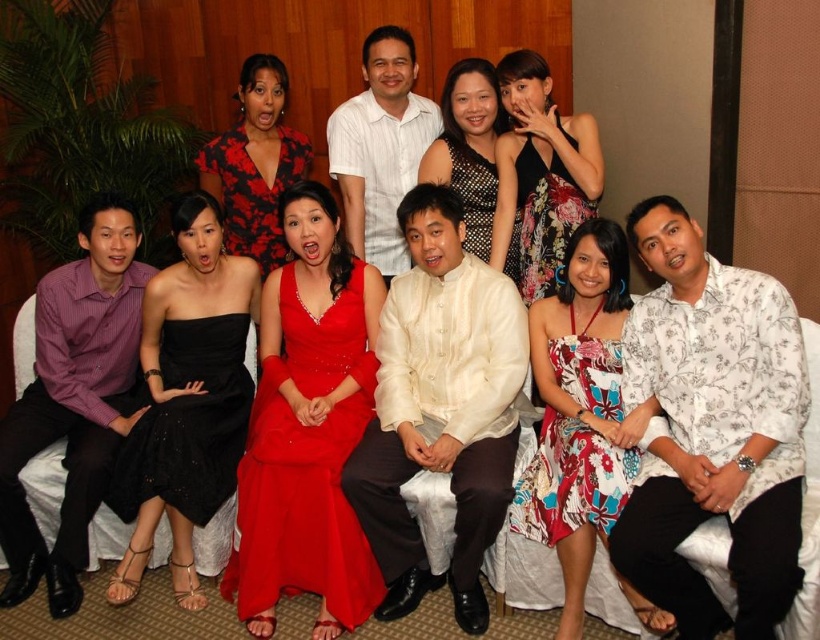
You are a photographer arranging a group photo. You have two dresses in the scene, the floral print dress at upper center and the sparkly black dress at center. Which dress should you focus on if you want to highlight a larger garment in the photo?

The floral print dress at upper center is bigger than the sparkly black dress at center, so you should focus on the floral print dress at upper center to highlight the larger garment.

You are standing in front of the scene and want to take a closer look at the floral print dress at upper center. If you can only move forward 5 feet, will you be able to get within 3 feet of the dress?

The floral print dress at upper center is currently 8.61 feet away from you. Moving forward 5 feet would bring you to 3.61 feet away, which is within the desired 3 feet range. Yes, you can get close enough.

You are a photographer arranging a group photo. You need to ensure that the shiny satin dress at center and the floral print dress at lower right are visible in the frame. Given their sizes, which dress might require more space to avoid being cropped?

The shiny satin dress at center has a larger width than the floral print dress at lower right, so it might require more space to avoid being cropped.